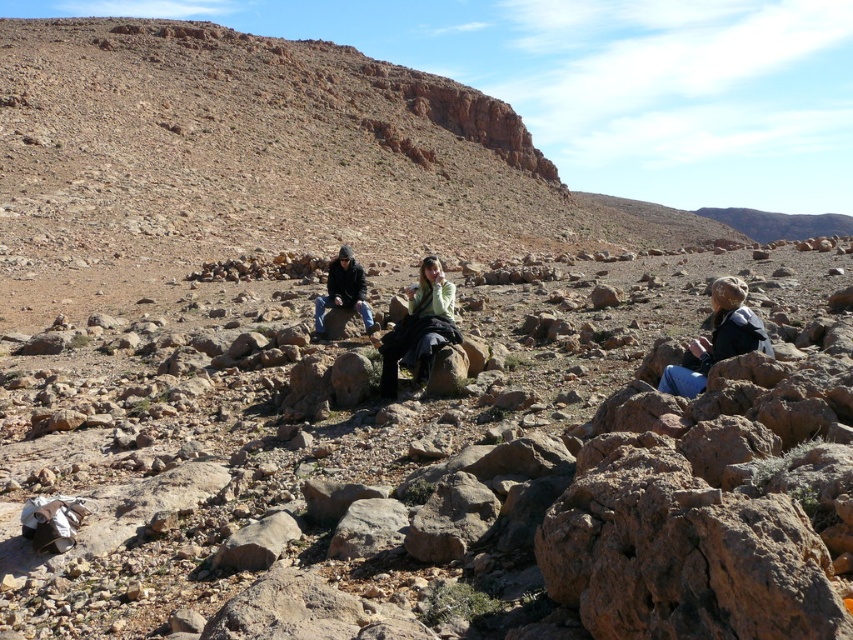
Consider the image. You are a hiker planning to place a small backpack between the blue denim jeans at lower right and the dark brown leather jacket at center. Based on their positions, where should you position the backpack to ensure it is between them?

The backpack should be placed between the blue denim jeans at lower right and the dark brown leather jacket at center, positioned above the blue denim jeans at lower right and below the dark brown leather jacket at center since the jeans are located below the jacket.

You are a photographer trying to capture a clear photo of the light green sweater at center and the dark brown leather jacket at center. Since you want both subjects to be in focus, which one should you focus on first to ensure the other is also sharp?

You should focus on the light green sweater at center first because it is in front of the dark brown leather jacket at center, so focusing on the closer subject will ensure the background subject is also in focus.

You are a hiker who needs to pass between the light green sweater at center and the dark brown leather jacket at center. The path between them is 4.79 meters wide. If your hiking backpack is 2 meters wide, can you safely navigate through this space without touching either?

The distance between the light green sweater at center and the dark brown leather jacket at center is 4.79 meters. Since your backpack is only 2 meters wide, you have enough space to pass safely between them without any issues.